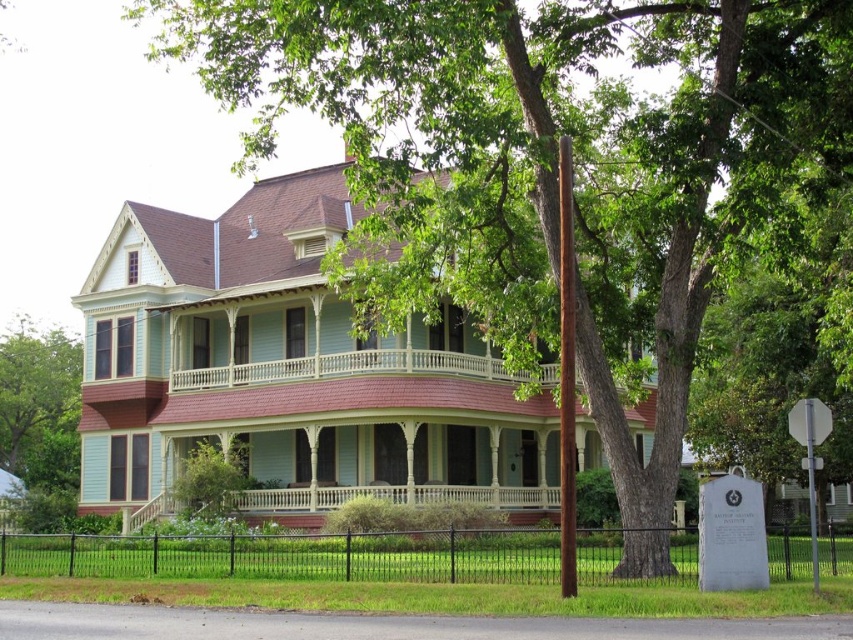
You are standing in a park and see the black metal fence at lower center. A child wants to throw a ball over the fence. The ball can travel 40 meters. Will the ball reach the fence?

The black metal fence at lower center is 41.57 meters away from the viewer. Since the ball can only travel 40 meters, it will not reach the fence.

You are a landscape architect designing a garden path that needs to pass between the black metal fence at lower center and the green leafy tree at left. To ensure the path is wide enough for a wheelbarrow, which is 1.2 meters wide, can you determine if there is sufficient space between them?

The black metal fence at lower center might be wider than green leafy tree at left, so the space between them may be sufficient for a 1.2 meter wide wheelbarrow. However, the exact width isn not provided, so further measurement is recommended.

You are standing at the point marked as point (386, 547) in the image. The house is 59.73 meters away from you. If you walk straight towards the house, will you first encounter the large tree in front of the house or the porch? Please explain your reasoning based on the given information.

The point marked as point (386, 547) is 59.73 meters away from the viewer. Since the large tree is mentioned to be in front of the house and the porch extends across both floors of the house, walking straight towards the house would first encounter the large tree before reaching the porch. Therefore, the large tree would be encountered first.